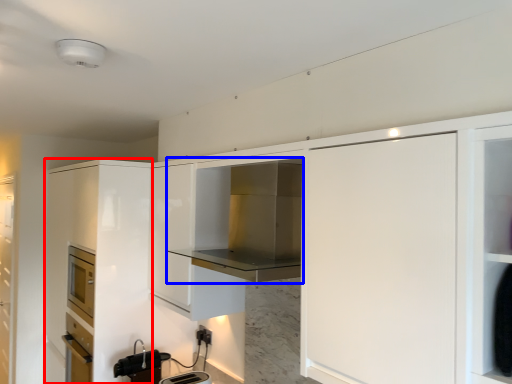
Question: Which object is further to the camera taking this photo, cabinetry (highlighted by a red box) or cabinetry (highlighted by a blue box)?

Choices:
 (A) cabinetry
 (B) cabinetry

Answer: (A)